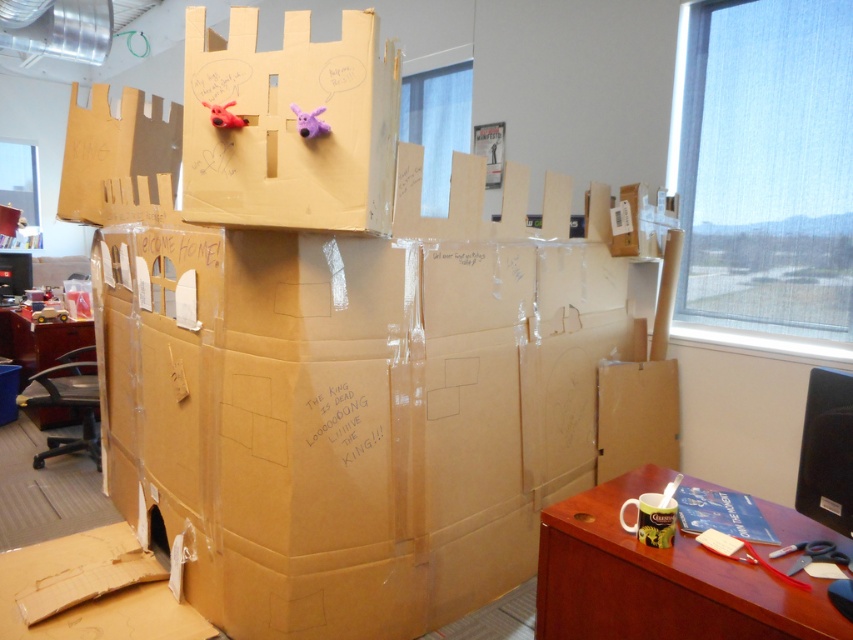
Question: Observing the image, what is the correct spatial positioning of wooden desk at lower right in reference to matte brown table at lower left?

Choices:
 (A) above
 (B) below

Answer: (B)

Question: Based on their relative distances, which object is farther from the wooden desk at lower right?

Choices:
 (A) matte brown table at lower left
 (B) brown cardboard box at center

Answer: (A)

Question: Does brown cardboard box at center appear over wooden desk at lower right?

Choices:
 (A) yes
 (B) no

Answer: (A)

Question: From the image, what is the correct spatial relationship of brown cardboard box at center in relation to matte brown table at lower left?

Choices:
 (A) left
 (B) right

Answer: (B)

Question: Which point is closer to the camera?

Choices:
 (A) matte brown table at lower left
 (B) brown cardboard box at center
 (C) wooden desk at lower right

Answer: (C)

Question: Which point is closer to the camera?

Choices:
 (A) wooden desk at lower right
 (B) brown cardboard box at center

Answer: (A)